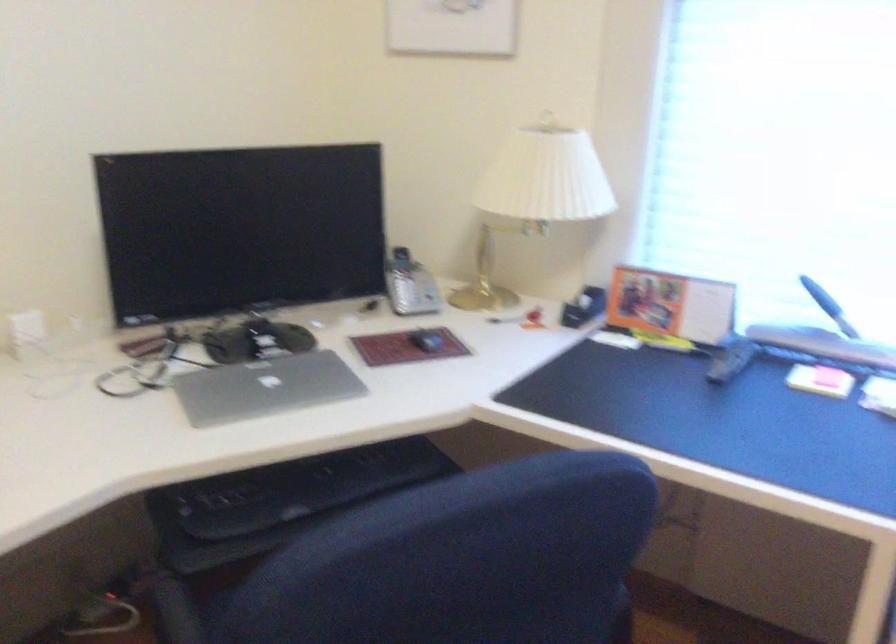
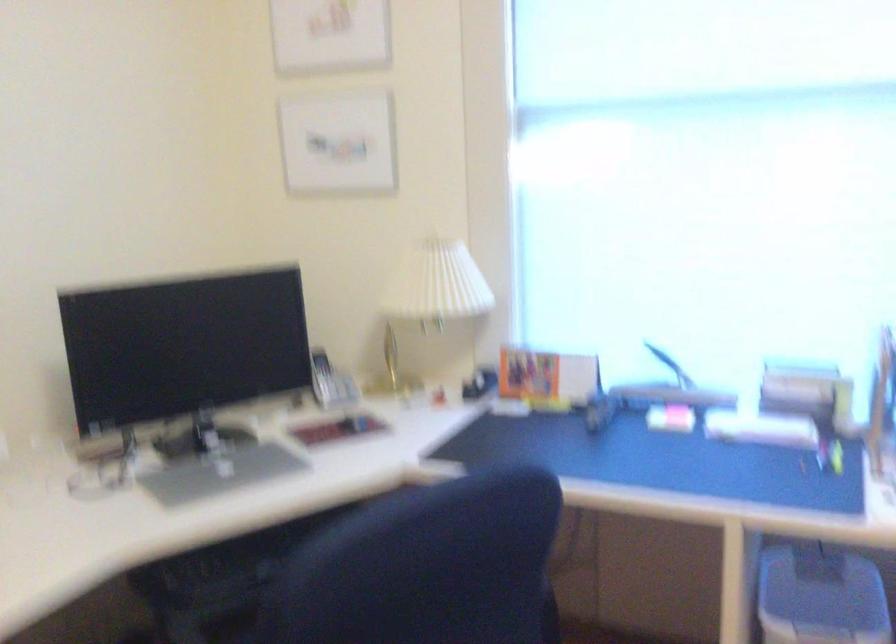
Where in the second image is the point corresponding to point (536, 194) from the first image?

(433, 295)